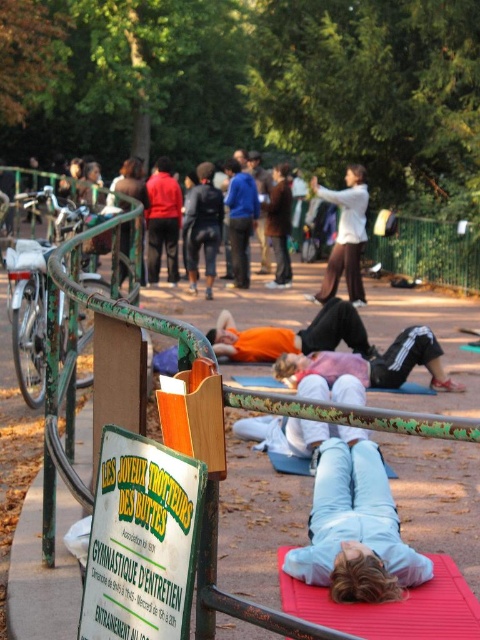
Can you confirm if dark blue jacket at center is positioned above red matte jacket at center?

Actually, dark blue jacket at center is below red matte jacket at center.

Between dark blue jacket at center and red matte jacket at center, which one is positioned lower?

Positioned lower is dark blue jacket at center.

Is point (186, 240) closer to viewer compared to point (146, 214)?

Yes, it is.

The width and height of the screenshot is (480, 640). I want to click on dark blue jacket at center, so [x=203, y=227].

Is green painted metal rail at center shorter than red matte jacket at center?

Yes.

At what (x,y) coordinates should I click in order to perform the action: click on green painted metal rail at center. Please return your answer as a coordinate pair (x, y). Looking at the image, I should click on (97, 371).

Based on the photo, can you confirm if red rubber yoga mat at lower center is positioned above dark blue jacket at center?

Incorrect, red rubber yoga mat at lower center is not positioned above dark blue jacket at center.

Does red rubber yoga mat at lower center have a lesser height compared to dark blue jacket at center?

Correct, red rubber yoga mat at lower center is not as tall as dark blue jacket at center.

Does point (425, 588) come closer to viewer compared to point (208, 220)?

That is True.

At what (x,y) coordinates should I click in order to perform the action: click on red rubber yoga mat at lower center. Please return your answer as a coordinate pair (x, y). Image resolution: width=480 pixels, height=640 pixels. Looking at the image, I should click on (392, 605).